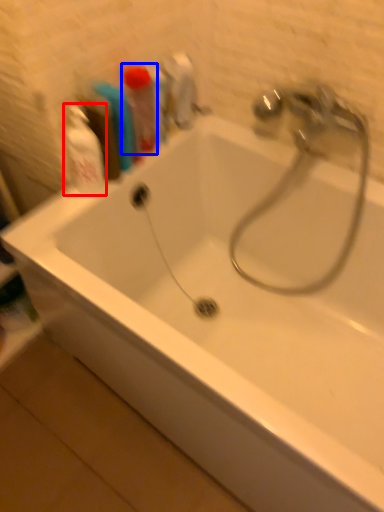
Question: Among these objects, which one is farthest to the camera, cleaning product (highlighted by a red box) or toiletry (highlighted by a blue box)?

Choices:
 (A) cleaning product
 (B) toiletry

Answer: (B)